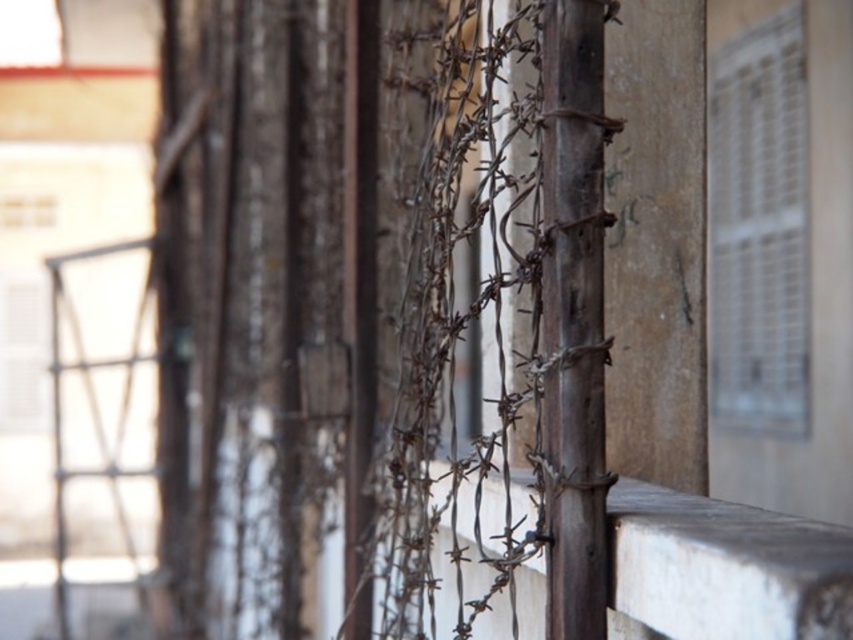
Does rusty wire fence at center have a smaller size compared to smooth concrete ledge at center?

Actually, rusty wire fence at center might be larger than smooth concrete ledge at center.

Is the position of rusty wire fence at center more distant than that of smooth concrete ledge at center?

Yes, it is behind smooth concrete ledge at center.

Where is `rusty wire fence at center`? rusty wire fence at center is located at coordinates point(370,296).

The image size is (853, 640). I want to click on rusty wire fence at center, so click(370, 296).

Can you confirm if metallic grid at upper right is positioned to the left of smooth concrete ledge at center?

No, metallic grid at upper right is not to the left of smooth concrete ledge at center.

The image size is (853, 640). I want to click on metallic grid at upper right, so click(x=759, y=228).

Does rusty wire fence at center have a smaller size compared to metallic grid at upper right?

Incorrect, rusty wire fence at center is not smaller in size than metallic grid at upper right.

Between point (408, 156) and point (769, 396), which one is positioned in front?

Point (408, 156) is in front.

Where is `rusty wire fence at center`? rusty wire fence at center is located at coordinates (370, 296).